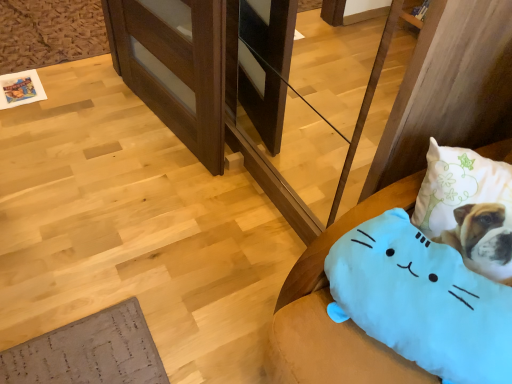
Where is `vacant area situated below wooden at left (from a real-world perspective)`? Image resolution: width=512 pixels, height=384 pixels. vacant area situated below wooden at left (from a real-world perspective) is located at coordinates (147, 132).